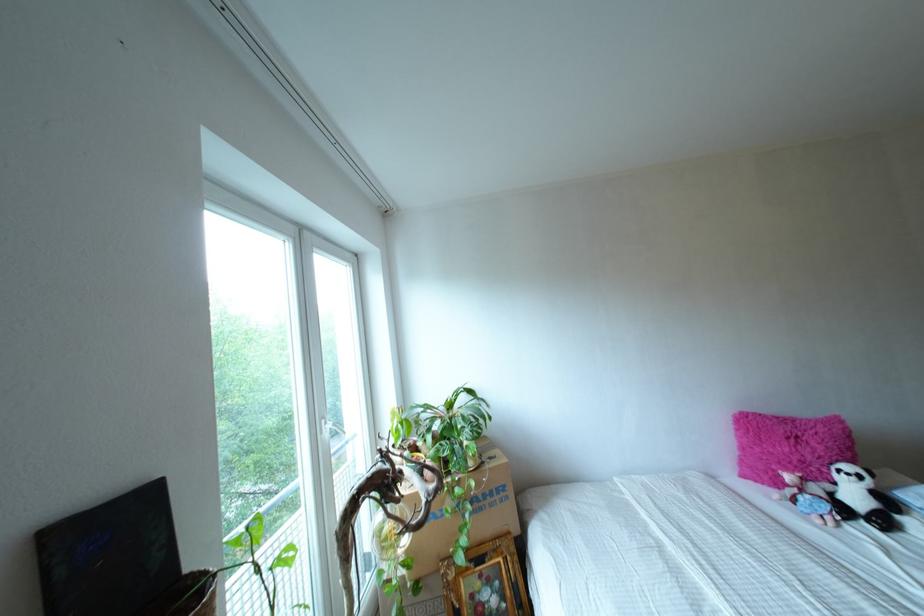
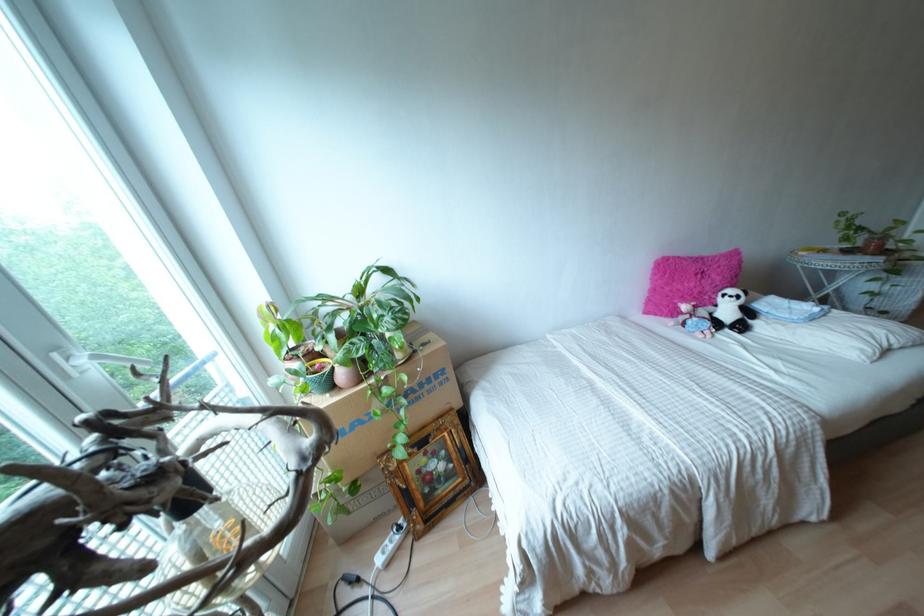
Where in the second image is the point corresponding to [825,485] from the first image?

(710, 308)